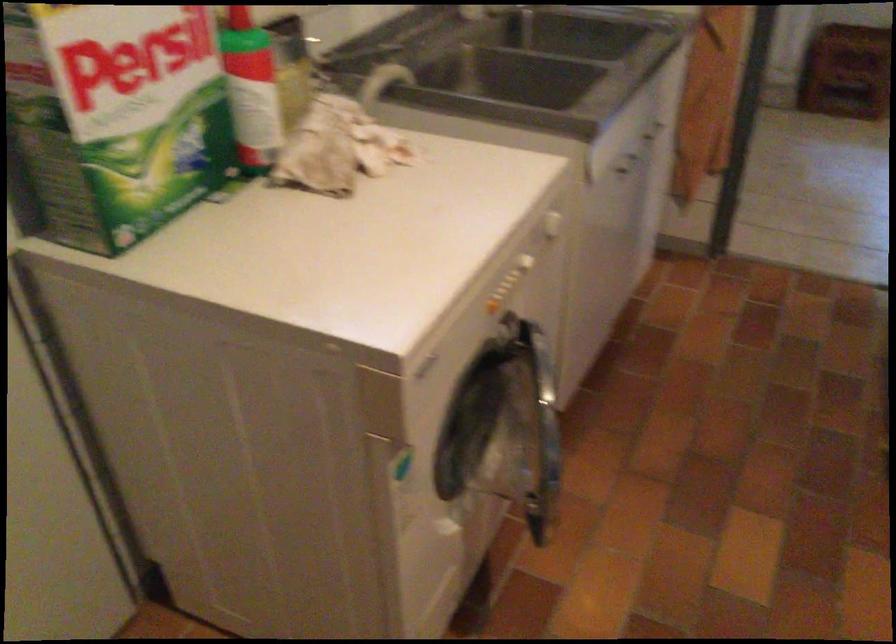
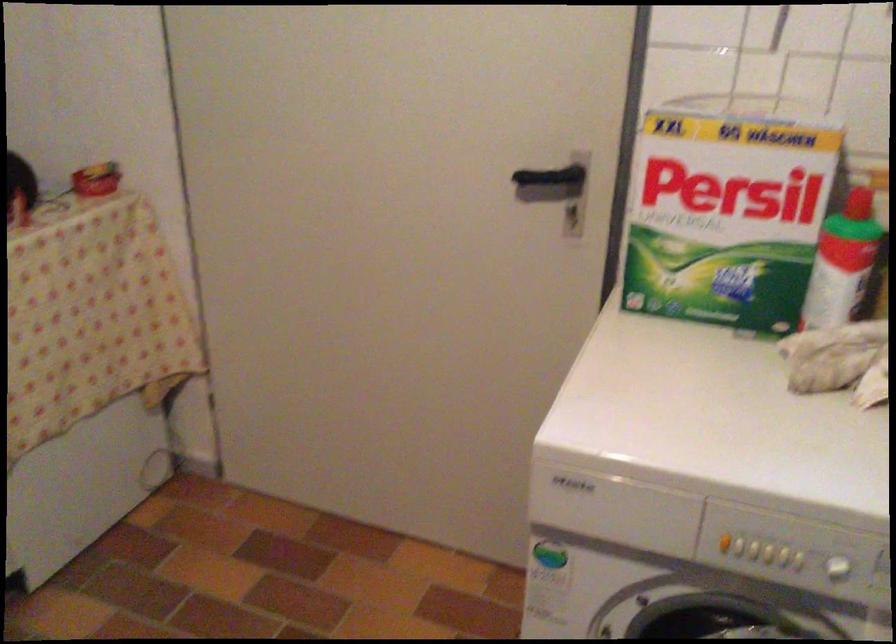
The images are taken continuously from a first-person perspective. In which direction is your viewpoint rotating?

The camera's rotation is toward left-down.